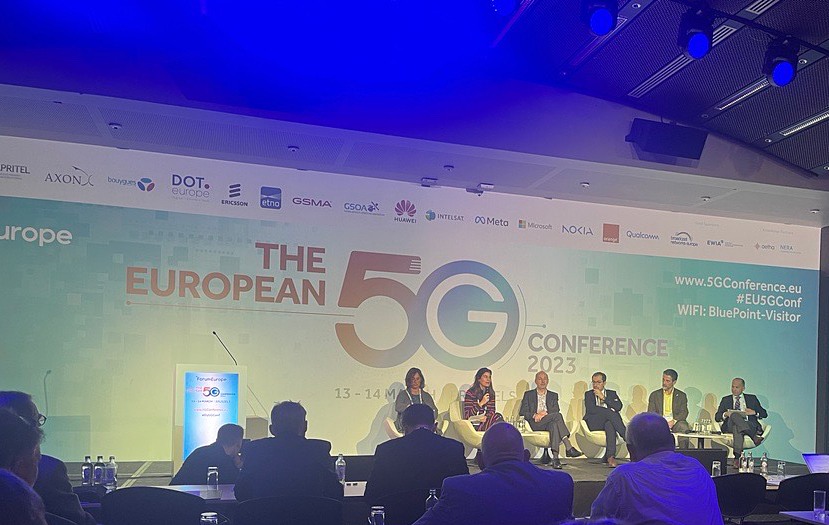
Identify the location of round table. (686, 432).